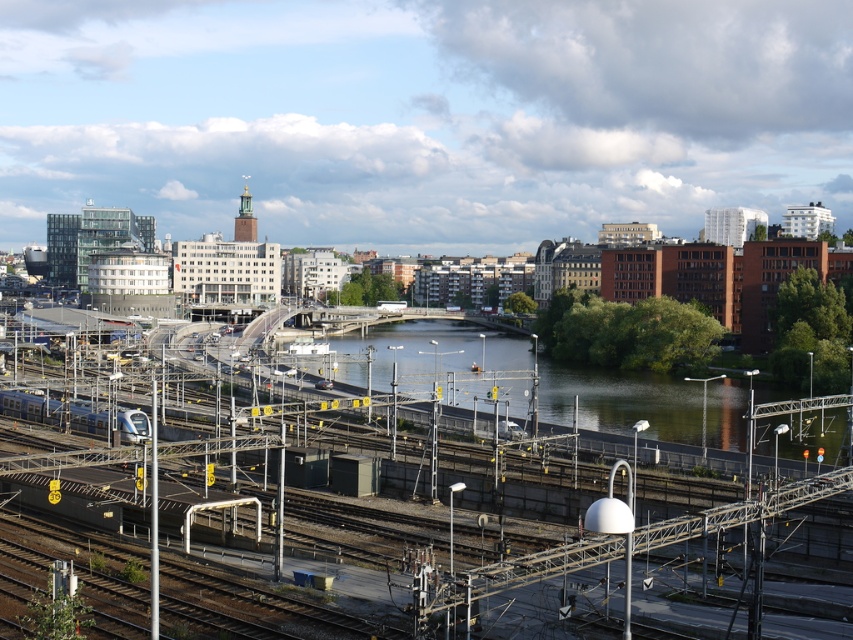
Question: Can you confirm if green water at center is smaller than silver metallic train at lower left?

Choices:
 (A) yes
 (B) no

Answer: (B)

Question: Which object appears closest to the camera in this image?

Choices:
 (A) silver metallic train at lower left
 (B) green water at center

Answer: (B)

Question: Does green water at center have a greater width compared to silver metallic train at lower left?

Choices:
 (A) no
 (B) yes

Answer: (B)

Question: From the image, what is the correct spatial relationship of green water at center in relation to silver metallic train at lower left?

Choices:
 (A) left
 (B) right

Answer: (B)

Question: Which object is farther from the camera taking this photo?

Choices:
 (A) green water at center
 (B) silver metallic train at lower left

Answer: (B)